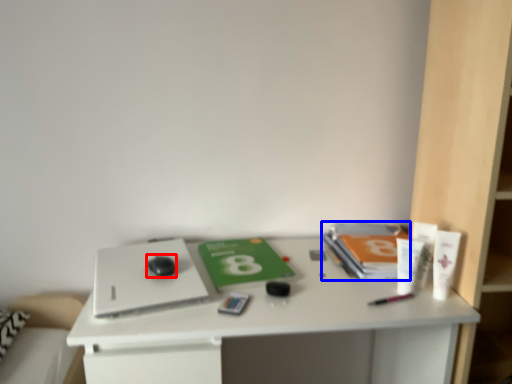
Question: Which object is further to the camera taking this photo, mouse (highlighted by a red box) or paperback book (highlighted by a blue box)?

Choices:
 (A) mouse
 (B) paperback book

Answer: (B)